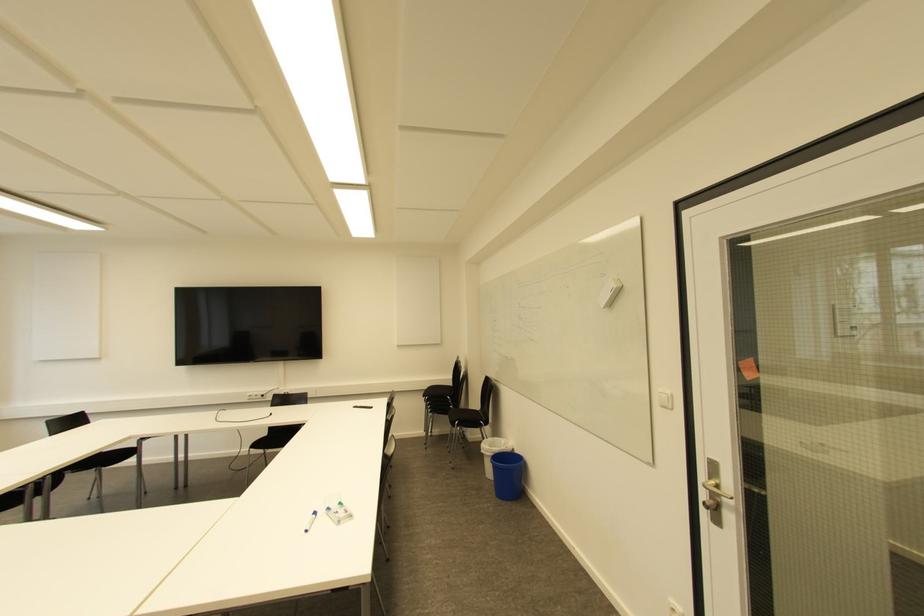
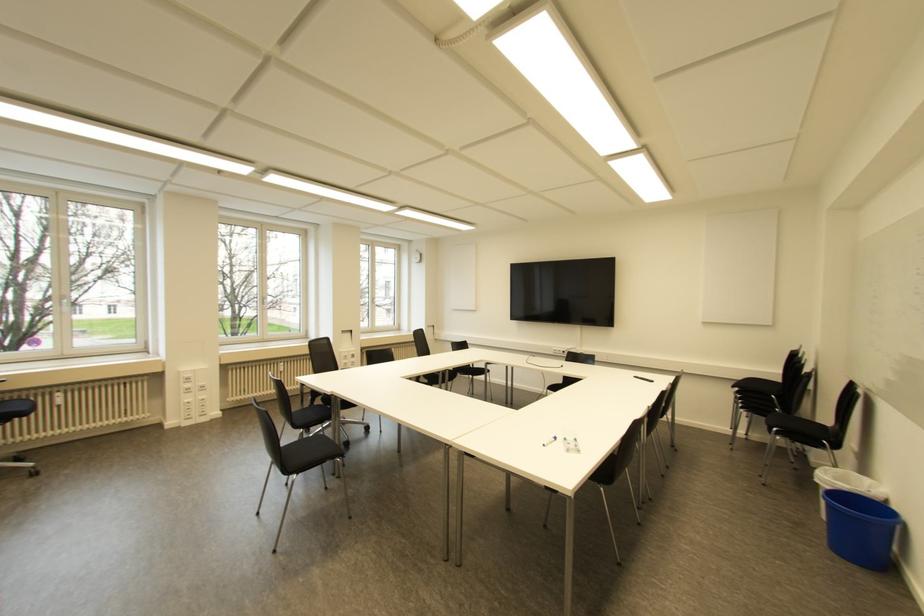
In the second image, find the point that corresponds to point 489,447 in the first image.

(829, 477)